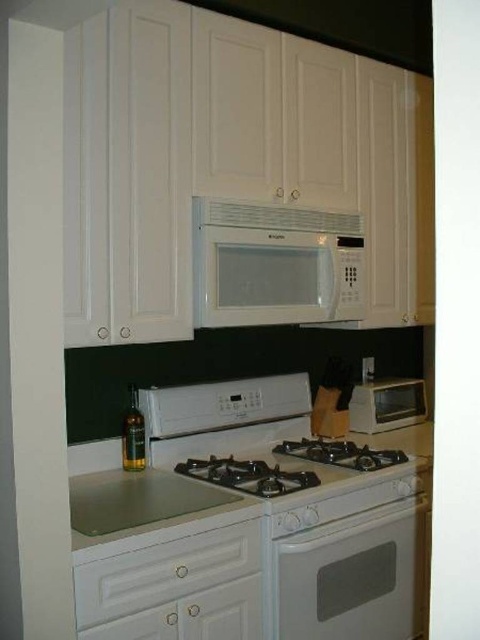
Does point (84, 497) lie behind point (207, 196)?

No, (84, 497) is in front of (207, 196).

Which is more to the right, transparent glass sink at center or white textured exhaust hood at upper center?

white textured exhaust hood at upper center

I want to click on transparent glass sink at center, so click(137, 499).

Which of these two, green glass stove at center or transparent glass sink at center, stands taller?

With more height is green glass stove at center.

Which of these two, green glass stove at center or transparent glass sink at center, stands shorter?

transparent glass sink at center

Between point (119, 525) and point (97, 481), which one is positioned in front?

Positioned in front is point (119, 525).

I want to click on green glass stove at center, so click(x=141, y=502).

What are the coordinates of `green glass stove at center` in the screenshot? It's located at (141, 502).

Is point (410, 452) positioned in front of point (424, 403)?

Yes, it is in front of point (424, 403).

At what (x,y) coordinates should I click in order to perform the action: click on green glass stove at center. Please return your answer as a coordinate pair (x, y). The width and height of the screenshot is (480, 640). Looking at the image, I should click on (141, 502).